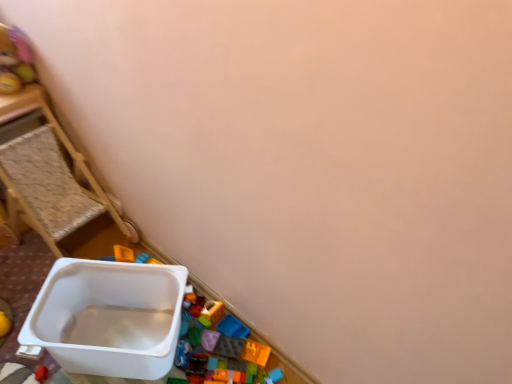
Find the location of a particular element. Image resolution: width=512 pixels, height=384 pixels. soft plush bear at upper left is located at coordinates (14, 60).

Describe the element at coordinates (14, 60) in the screenshot. The width and height of the screenshot is (512, 384). I see `soft plush bear at upper left` at that location.

What is the approximate width of soft plush bear at upper left?

soft plush bear at upper left is 16.14 centimeters in width.

This screenshot has height=384, width=512. What do you see at coordinates (49, 177) in the screenshot? I see `white plastic container at left` at bounding box center [49, 177].

The height and width of the screenshot is (384, 512). In order to click on white plastic container at left in this screenshot , I will do `click(49, 177)`.

Where is `soft plush bear at upper left`? This screenshot has height=384, width=512. soft plush bear at upper left is located at coordinates (14, 60).

Which object is positioned more to the right, white plastic container at left or soft plush bear at upper left?

white plastic container at left.

Is the depth of white plastic container at left less than that of soft plush bear at upper left?

Yes, white plastic container at left is in front of soft plush bear at upper left.

Is point (131, 236) behind point (29, 73)?

Yes, it is behind point (29, 73).

From the image's perspective, is white plastic container at left located above or below soft plush bear at upper left?

Clearly, from the image's perspective, white plastic container at left is below soft plush bear at upper left.

From a real-world perspective, is white plastic container at left physically above soft plush bear at upper left?

Incorrect, from a real-world perspective, white plastic container at left is lower than soft plush bear at upper left.

Is white plastic container at left wider or thinner than soft plush bear at upper left?

Clearly, white plastic container at left has more width compared to soft plush bear at upper left.

Considering the relative sizes of white plastic container at left and soft plush bear at upper left in the image provided, is white plastic container at left taller than soft plush bear at upper left?

Indeed, white plastic container at left has a greater height compared to soft plush bear at upper left.

Does white plastic container at left have a smaller size compared to soft plush bear at upper left?

No, white plastic container at left is not smaller than soft plush bear at upper left.

Is white plastic container at left located outside soft plush bear at upper left?

Yes, white plastic container at left is outside of soft plush bear at upper left.

Is the surface of white plastic container at left in direct contact with soft plush bear at upper left?

No, white plastic container at left is not making contact with soft plush bear at upper left.

Based on the photo, could you tell me if white plastic container at left is facing soft plush bear at upper left?

No, white plastic container at left is not facing towards soft plush bear at upper left.

Measure the distance from white plastic container at left to soft plush bear at upper left.

They are 11.67 inches apart.

The height and width of the screenshot is (384, 512). What are the coordinates of `toy on the left side of white plastic container at left` in the screenshot? It's located at (14, 60).

Which object is positioned more to the right, soft plush bear at upper left or white plastic container at left?

From the viewer's perspective, white plastic container at left appears more on the right side.

Is soft plush bear at upper left positioned before white plastic container at left?

No, it is not.

Which is nearer, (16, 52) or (28, 152)?

Point (16, 52).

From the image's perspective, between soft plush bear at upper left and white plastic container at left, who is located below?

white plastic container at left is shown below in the image.

From a real-world perspective, is soft plush bear at upper left above or below white plastic container at left?

soft plush bear at upper left is situated higher than white plastic container at left in the real world.

From the picture: Can you confirm if soft plush bear at upper left is wider than white plastic container at left?

No, soft plush bear at upper left is not wider than white plastic container at left.

Is soft plush bear at upper left taller than white plastic container at left?

No.

Can you confirm if soft plush bear at upper left is bigger than white plastic container at left?

No.

Is soft plush bear at upper left spatially inside white plastic container at left, or outside of it?

soft plush bear at upper left is not inside white plastic container at left, it's outside.

Are soft plush bear at upper left and white plastic container at left beside each other?

No, soft plush bear at upper left is not with white plastic container at left.

Is soft plush bear at upper left oriented towards white plastic container at left?

No, soft plush bear at upper left does not turn towards white plastic container at left.

In order to click on furniture in front of the soft plush bear at upper left in this screenshot , I will do `click(49, 177)`.

The image size is (512, 384). Identify the location of furniture located on the right of soft plush bear at upper left. (49, 177).

The image size is (512, 384). In order to click on furniture in front of the soft plush bear at upper left in this screenshot , I will do `click(49, 177)`.